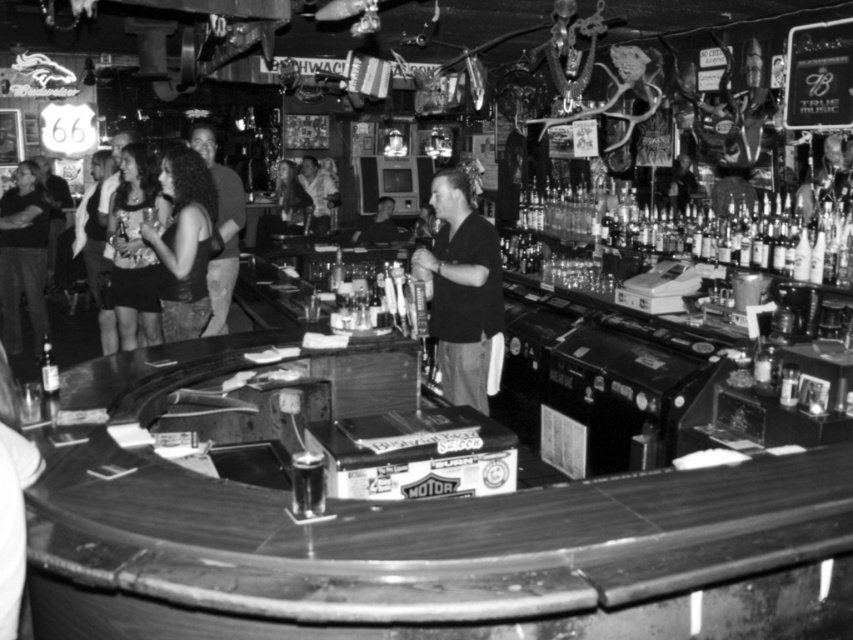
Question: Can you confirm if dark brown leather jacket at center is positioned to the left of matte black dress at left?

Choices:
 (A) yes
 (B) no

Answer: (B)

Question: Which point is closer to the camera?

Choices:
 (A) dark hair at left
 (B) matte black dress at left

Answer: (B)

Question: Which point is farther to the camera?

Choices:
 (A) (50, 346)
 (B) (119, 298)
 (C) (236, 259)
 (D) (496, 310)

Answer: (A)

Question: Which object is farther from the camera taking this photo?

Choices:
 (A) dark hair at left
 (B) matte black dress at left
 (C) dark brown leather jacket at center

Answer: (A)

Question: In this image, where is matte black dress at left located relative to smooth leather jacket at center?

Choices:
 (A) right
 (B) left

Answer: (B)

Question: Does dark fabric shirt at center appear on the right side of clear glass bottle at bar left?

Choices:
 (A) no
 (B) yes

Answer: (B)